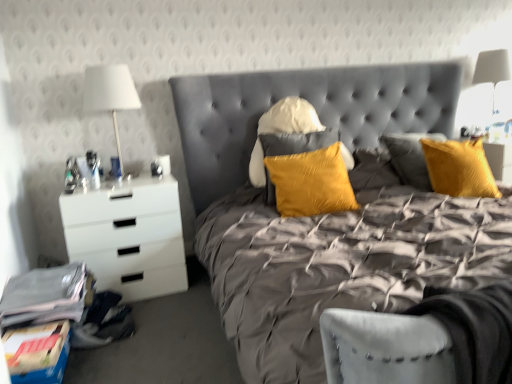
Question: Is white fabric lampshade at upper right, which is the 2th bedside lamp from left to right, wider or thinner than satin yellow pillow at center?

Choices:
 (A) thin
 (B) wide

Answer: (B)

Question: Is white fabric lampshade at upper right, which is the 2th bedside lamp from left to right, to the left or to the right of satin yellow pillow at center in the image?

Choices:
 (A) right
 (B) left

Answer: (A)

Question: Based on their relative distances, which object is nearer to the satin yellow pillow at center?

Choices:
 (A) velvet grey bed at center
 (B) white glossy chest of drawers at left
 (C) white fabric lampshade at upper right, which is the 1th bedside lamp from back to front
 (D) white fabric lampshade at left, which is the 1th bedside lamp in left-to-right order

Answer: (A)

Question: Estimate the real-world distances between objects in this image. Which object is farther from the white glossy chest of drawers at left?

Choices:
 (A) white fabric lampshade at upper right, which is the 2th bedside lamp from left to right
 (B) velvet grey bed at center
 (C) white fabric lampshade at left, which appears as the first bedside lamp when viewed from the front
 (D) satin yellow pillow at center

Answer: (A)